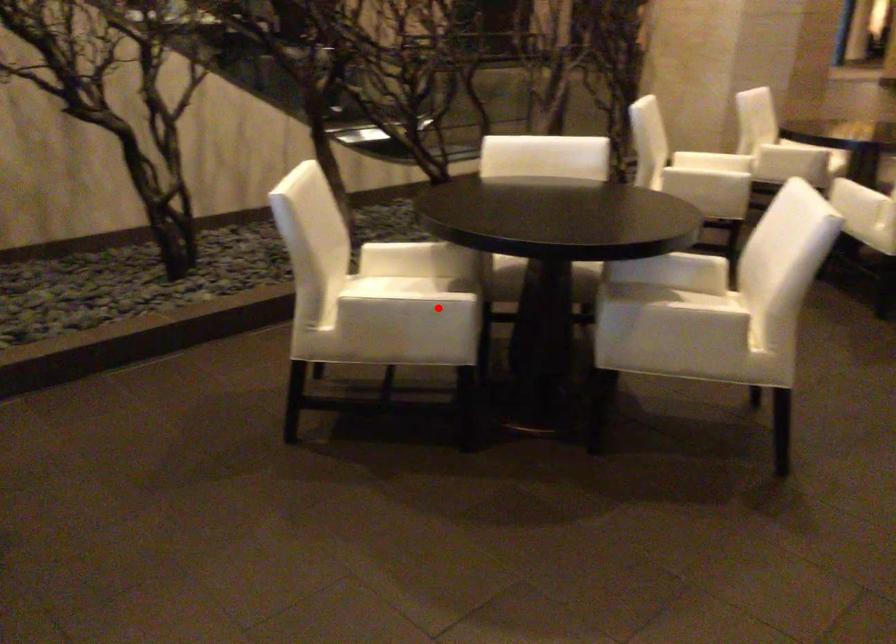
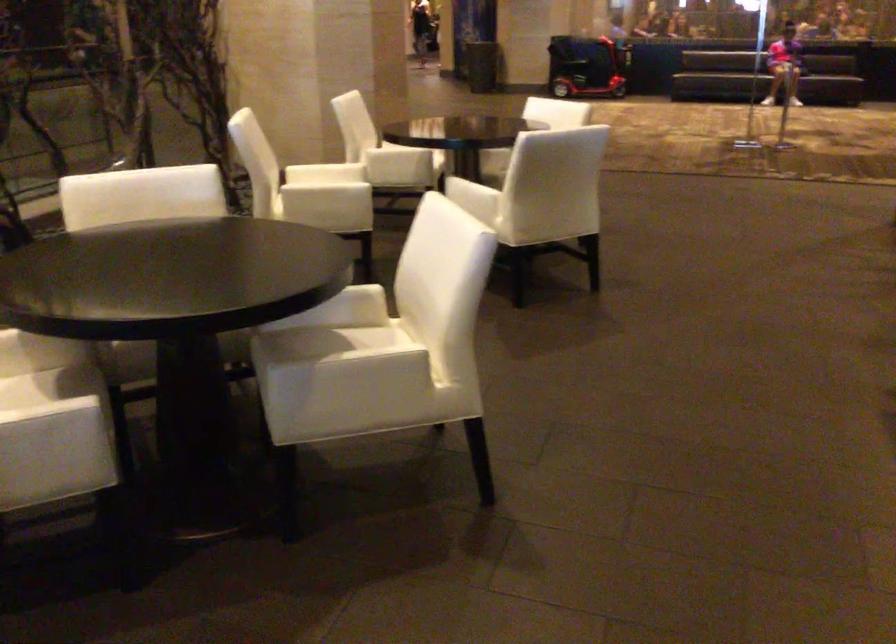
Question: I am providing you with two images of the same scene from different viewpoints. In image1, a red point is highlighted. Considering the same 3D point in image2, which of the following is correct?

Choices:
 (A) It is closer
 (B) It is farther

Answer: (A)